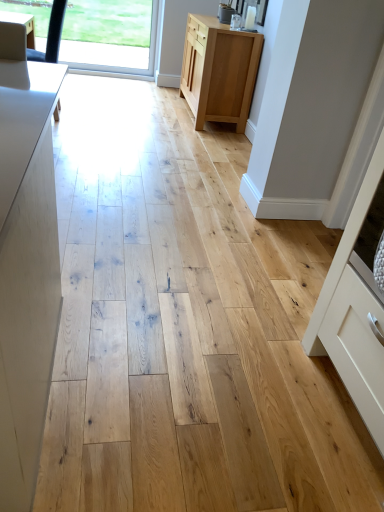
Question: Considering the relative sizes of natural wood cabinet at center, arranged as the 2th cabinetry when viewed from the right, and white matte cabinet at right, the 1th cabinetry positioned from the right, in the image provided, is natural wood cabinet at center, arranged as the 2th cabinetry when viewed from the right, thinner than white matte cabinet at right, the 1th cabinetry positioned from the right,?

Choices:
 (A) no
 (B) yes

Answer: (A)

Question: Considering the relative sizes of natural wood cabinet at center, which is counted as the second cabinetry, starting from the front, and white matte cabinet at right, the 2th cabinetry when ordered from top to bottom, in the image provided, is natural wood cabinet at center, which is counted as the second cabinetry, starting from the front, shorter than white matte cabinet at right, the 2th cabinetry when ordered from top to bottom,?

Choices:
 (A) no
 (B) yes

Answer: (B)

Question: Considering the relative sizes of natural wood cabinet at center, arranged as the 2th cabinetry when viewed from the right, and white matte cabinet at right, the 1th cabinetry positioned from the right, in the image provided, is natural wood cabinet at center, arranged as the 2th cabinetry when viewed from the right, taller than white matte cabinet at right, the 1th cabinetry positioned from the right,?

Choices:
 (A) yes
 (B) no

Answer: (B)

Question: Considering the relative positions of natural wood cabinet at center, which is the first cabinetry from top to bottom, and white matte cabinet at right, arranged as the second cabinetry when viewed from the left, in the image provided, is natural wood cabinet at center, which is the first cabinetry from top to bottom, behind white matte cabinet at right, arranged as the second cabinetry when viewed from the left,?

Choices:
 (A) yes
 (B) no

Answer: (A)

Question: Is natural wood cabinet at center, which appears as the second cabinetry when ordered from the bottom, positioned with its back to white matte cabinet at right, the first cabinetry positioned from the front?

Choices:
 (A) no
 (B) yes

Answer: (A)

Question: From their relative heights in the image, would you say natural wood cabinet at center, marked as the first cabinetry in a back-to-front arrangement, is taller or shorter than transparent glass window at upper left?

Choices:
 (A) tall
 (B) short

Answer: (B)

Question: Is natural wood cabinet at center, arranged as the 2th cabinetry when viewed from the right, spatially inside transparent glass window at upper left, or outside of it?

Choices:
 (A) outside
 (B) inside

Answer: (A)

Question: In terms of width, does natural wood cabinet at center, marked as the first cabinetry in a back-to-front arrangement, look wider or thinner when compared to transparent glass window at upper left?

Choices:
 (A) thin
 (B) wide

Answer: (B)

Question: Is point (206, 74) closer or farther from the camera than point (152, 16)?

Choices:
 (A) farther
 (B) closer

Answer: (B)

Question: Choose the correct answer: Is white matte cabinet at right, the 2th cabinetry in the back-to-front sequence, inside transparent glass window at upper left or outside it?

Choices:
 (A) inside
 (B) outside

Answer: (B)

Question: Considering the positions of point (362, 263) and point (139, 49), is point (362, 263) closer or farther from the camera than point (139, 49)?

Choices:
 (A) farther
 (B) closer

Answer: (B)

Question: From the image's perspective, is white matte cabinet at right, the 2th cabinetry when ordered from top to bottom, above or below transparent glass window at upper left?

Choices:
 (A) above
 (B) below

Answer: (B)

Question: Looking at their shapes, would you say white matte cabinet at right, the 2th cabinetry in the back-to-front sequence, is wider or thinner than transparent glass window at upper left?

Choices:
 (A) thin
 (B) wide

Answer: (B)

Question: Is point (337, 313) positioned closer to the camera than point (256, 33)?

Choices:
 (A) farther
 (B) closer

Answer: (B)

Question: In the image, is white matte cabinet at right, the 2th cabinetry when ordered from top to bottom, positioned in front of or behind natural wood cabinet at center, which appears as the second cabinetry when ordered from the bottom?

Choices:
 (A) behind
 (B) front

Answer: (B)